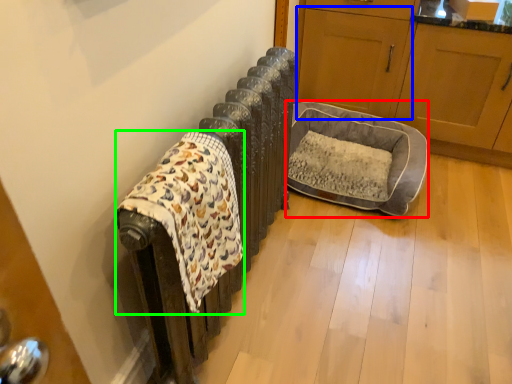
Question: Which object is the closest to the dog bed (highlighted by a red box)? Choose among these: screen door (highlighted by a blue box) or blanket (highlighted by a green box).

Choices:
 (A) screen door
 (B) blanket

Answer: (A)